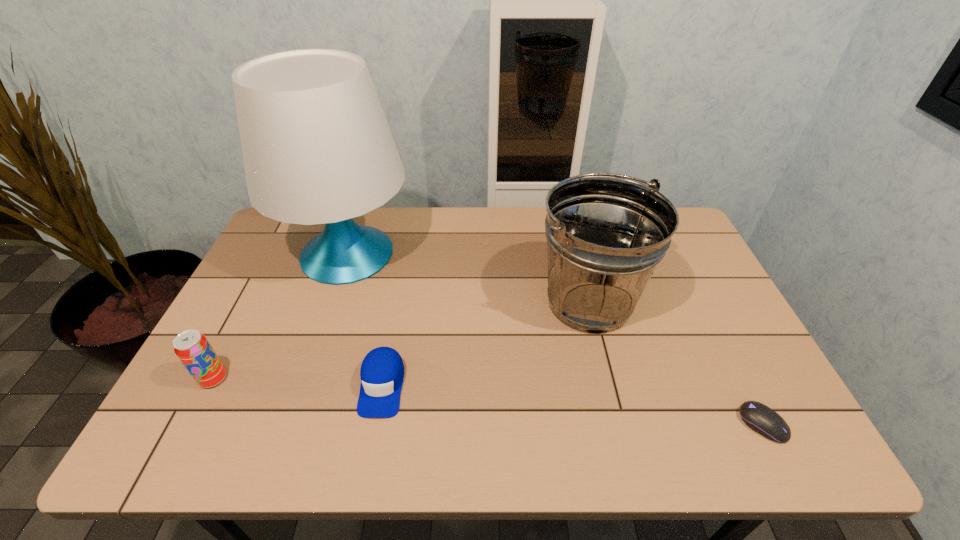
Locate an element on the screen. This screenshot has height=540, width=960. vacant point that satisfies the following two spatial constraints: 1. on the front-facing side of the tallest object; 2. on the right side of the bucket is located at coordinates (331, 302).

You are a GUI agent. You are given a task and a screenshot of the screen. Output one action in this format:
    pyautogui.click(x=<x>, y=<y>)
    Task: Click on the free space that satisfies the following two spatial constraints: 1. on the front-facing side of the second object from right to left; 2. on the right side of the table lamp
    
    Given the screenshot: What is the action you would take?
    pyautogui.click(x=331, y=302)

Where is `vacant region that satisfies the following two spatial constraints: 1. on the front-facing side of the table lamp; 2. on the front side of the soda can`? This screenshot has height=540, width=960. vacant region that satisfies the following two spatial constraints: 1. on the front-facing side of the table lamp; 2. on the front side of the soda can is located at coordinates (305, 379).

The image size is (960, 540). Find the location of `free space that satisfies the following two spatial constraints: 1. on the front-facing side of the fourth tallest object; 2. on the right side of the computer mouse`. free space that satisfies the following two spatial constraints: 1. on the front-facing side of the fourth tallest object; 2. on the right side of the computer mouse is located at coordinates (374, 424).

This screenshot has height=540, width=960. Identify the location of vacant space that satisfies the following two spatial constraints: 1. on the front-facing side of the shortest object; 2. on the left side of the second shortest object. (374, 424).